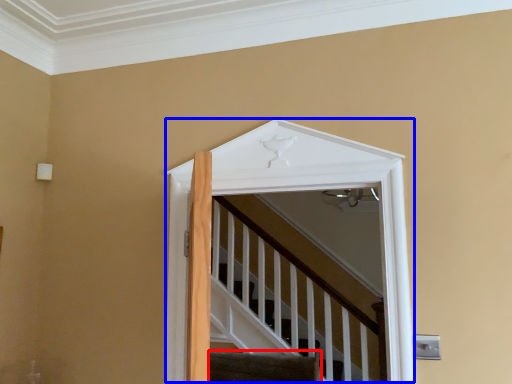
Question: Which object appears farthest to the camera in this image, stairs (highlighted by a red box) or elevator (highlighted by a blue box)?

Choices:
 (A) stairs
 (B) elevator

Answer: (A)